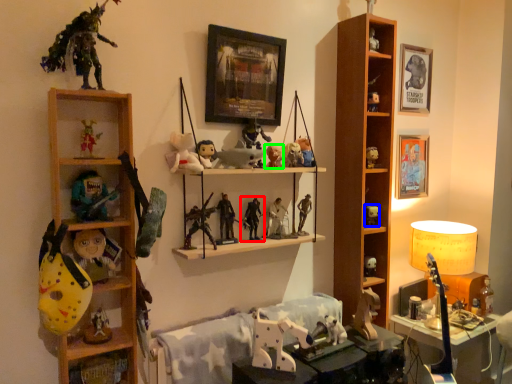
Question: Which is nearer to the toy (highlighted by a red box)? toy (highlighted by a blue box) or toy (highlighted by a green box).

Choices:
 (A) toy
 (B) toy

Answer: (B)